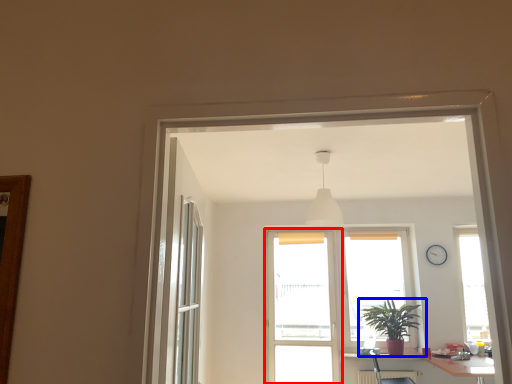
Question: Which of the following is the farthest to the observer, screen door (highlighted by a red box) or houseplant (highlighted by a blue box)?

Choices:
 (A) screen door
 (B) houseplant

Answer: (A)